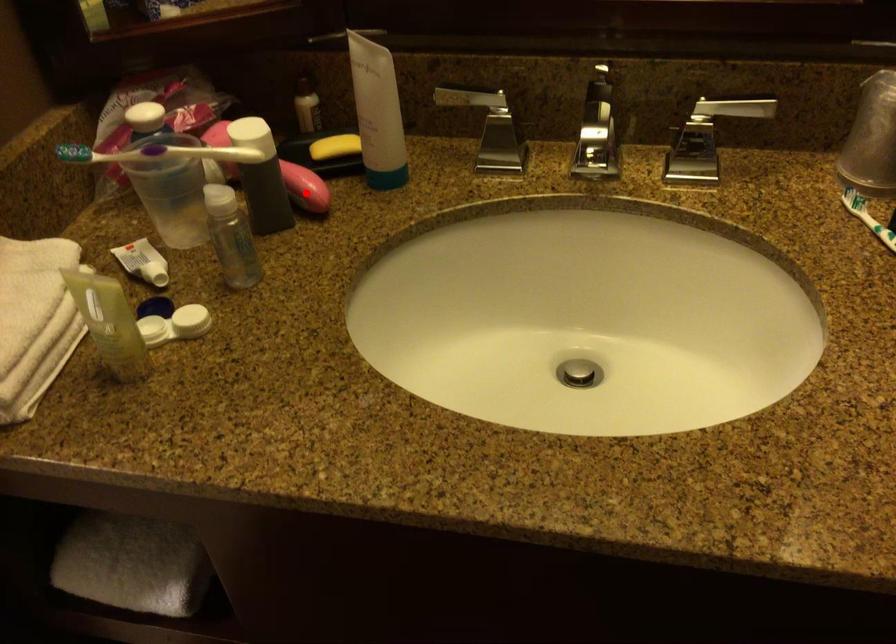
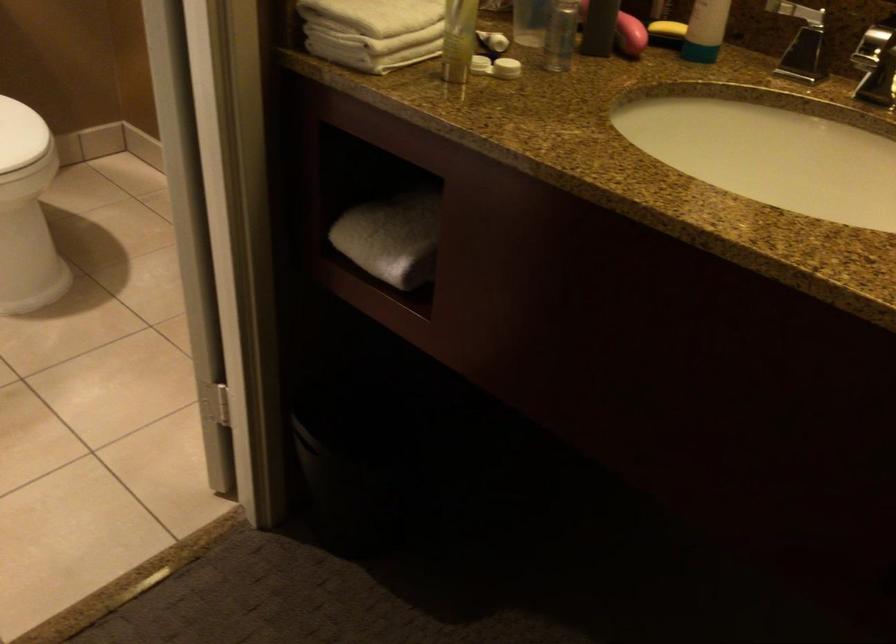
Question: I am providing you with two images of the same scene from different viewpoints. In image1, a red point is highlighted. Considering the same 3D point in image2, which of the following is correct?

Choices:
 (A) It is closer
 (B) It is farther

Answer: (B)